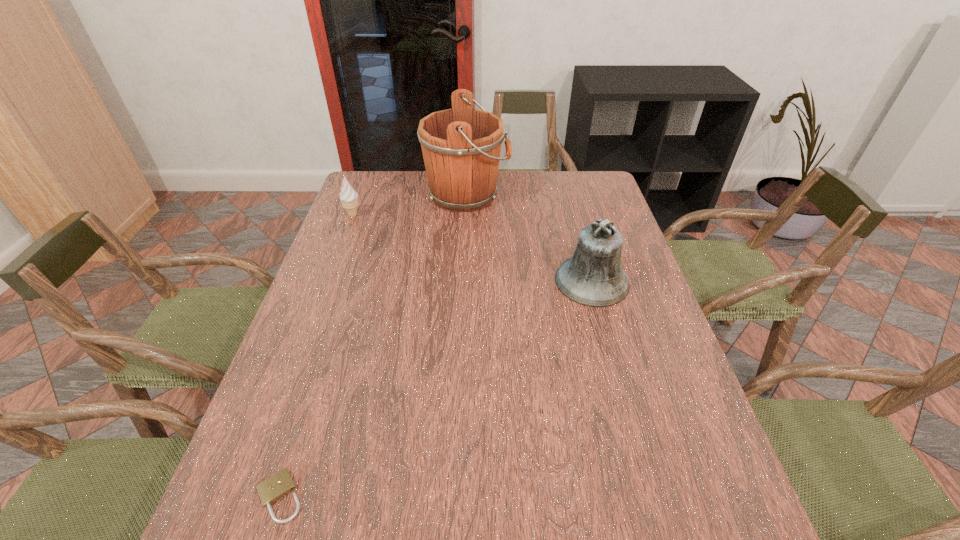
Image resolution: width=960 pixels, height=540 pixels. Identify the location of vacant region located 0.060m on the back of the nearest object. 298,441.

Locate an element on the screen. object situated at the far edge is located at coordinates [x=461, y=146].

Locate an element on the screen. This screenshot has height=540, width=960. icecream located at the left edge is located at coordinates (349, 197).

The image size is (960, 540). I want to click on padlock located in the left edge section of the desktop, so 280,484.

Identify the location of object that is at the right edge. This screenshot has width=960, height=540. (593, 276).

Where is `free location at the far edge`? free location at the far edge is located at coordinates (556, 186).

Identify the location of free space at the left edge of the desktop. Image resolution: width=960 pixels, height=540 pixels. (306, 302).

The width and height of the screenshot is (960, 540). In the image, there is a desktop. Find the location of `free space at the right edge`. free space at the right edge is located at coordinates (650, 356).

Locate an element on the screen. free location at the far right corner of the desktop is located at coordinates (561, 183).

Locate an element on the screen. free space between the shortest object and the third shortest object is located at coordinates point(436,389).